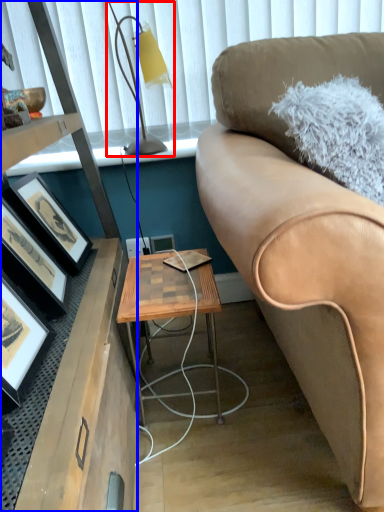
Question: Which object appears closest to the camera in this image, table lamp (highlighted by a red box) or desk (highlighted by a blue box)?

Choices:
 (A) table lamp
 (B) desk

Answer: (B)